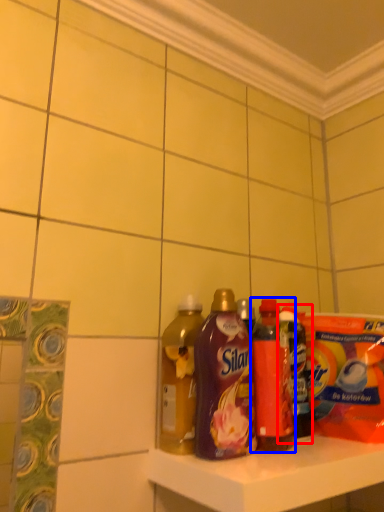
Question: Which object is further to the camera taking this photo, bottle (highlighted by a red box) or bottle (highlighted by a blue box)?

Choices:
 (A) bottle
 (B) bottle

Answer: (A)